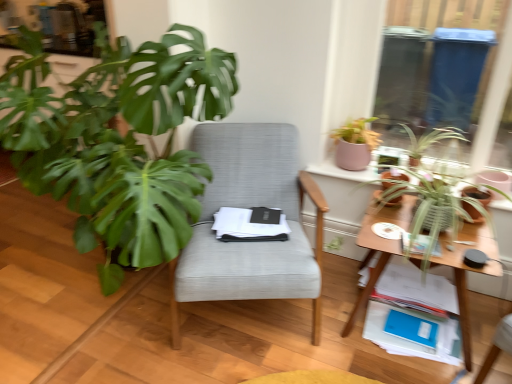
Question: From a real-world perspective, is pink matte pot at upper right, the fourth houseplant viewed from the right, physically below textured gray chair at center?

Choices:
 (A) no
 (B) yes

Answer: (A)

Question: Is there a large distance between pink matte pot at upper right, the fourth houseplant viewed from the right, and textured gray chair at center?

Choices:
 (A) no
 (B) yes

Answer: (A)

Question: Is pink matte pot at upper right, positioned as the 2th houseplant in left-to-right order, located outside textured gray chair at center?

Choices:
 (A) yes
 (B) no

Answer: (A)

Question: Would you say textured gray chair at center is part of pink matte pot at upper right, positioned as the 2th houseplant in left-to-right order,'s contents?

Choices:
 (A) no
 (B) yes

Answer: (A)

Question: Is pink matte pot at upper right, the fourth houseplant viewed from the right, taller than textured gray chair at center?

Choices:
 (A) no
 (B) yes

Answer: (A)

Question: Is wooden table at right taller or shorter than green matte plant at left, the 1th houseplant in the left-to-right sequence?

Choices:
 (A) short
 (B) tall

Answer: (A)

Question: Would you say wooden table at right is to the left or to the right of green matte plant at left, the 1th houseplant in the left-to-right sequence, in the picture?

Choices:
 (A) right
 (B) left

Answer: (A)

Question: From a real-world perspective, is wooden table at right physically located above or below green matte plant at left, the fifth houseplant from the right?

Choices:
 (A) above
 (B) below

Answer: (B)

Question: From the image's perspective, relative to green matte plant at left, the fifth houseplant from the right, is wooden table at right above or below?

Choices:
 (A) above
 (B) below

Answer: (B)

Question: From a real-world perspective, is green matte plant pot at right, placed as the 1th flowerpot when sorted from right to left, above or below green leafy plant at upper right, positioned as the first houseplant in right-to-left order?

Choices:
 (A) above
 (B) below

Answer: (B)

Question: Considering the relative positions of green matte plant pot at right, placed as the 1th flowerpot when sorted from right to left, and green leafy plant at upper right, positioned as the first houseplant in right-to-left order, in the image provided, is green matte plant pot at right, placed as the 1th flowerpot when sorted from right to left, to the left or to the right of green leafy plant at upper right, positioned as the first houseplant in right-to-left order,?

Choices:
 (A) right
 (B) left

Answer: (A)

Question: Is point (486, 195) closer or farther from the camera than point (463, 137)?

Choices:
 (A) closer
 (B) farther

Answer: (A)

Question: Considering the positions of green matte plant pot at right, placed as the 1th flowerpot when sorted from right to left, and green leafy plant at upper right, which is the 5th houseplant in left-to-right order, in the image, is green matte plant pot at right, placed as the 1th flowerpot when sorted from right to left, wider or thinner than green leafy plant at upper right, which is the 5th houseplant in left-to-right order,?

Choices:
 (A) wide
 (B) thin

Answer: (B)

Question: Is point pyautogui.click(x=388, y=172) positioned closer to the camera than point pyautogui.click(x=266, y=243)?

Choices:
 (A) closer
 (B) farther

Answer: (B)

Question: From a real-world perspective, is matte brown flowerpot at upper right, marked as the 2th flowerpot in a right-to-left arrangement, above or below textured gray chair at center?

Choices:
 (A) above
 (B) below

Answer: (A)